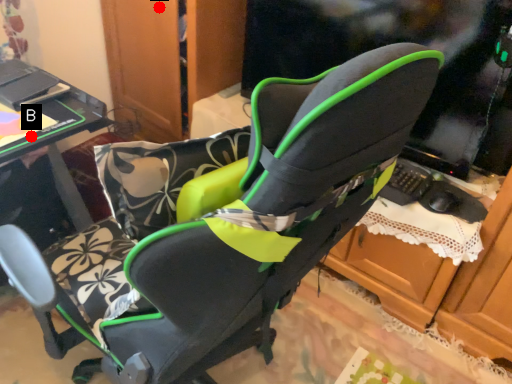
Question: Two points are circled on the image, labeled by A and B beside each circle. Among these points, which one is nearest to the camera?

Choices:
 (A) A is closer
 (B) B is closer

Answer: (B)